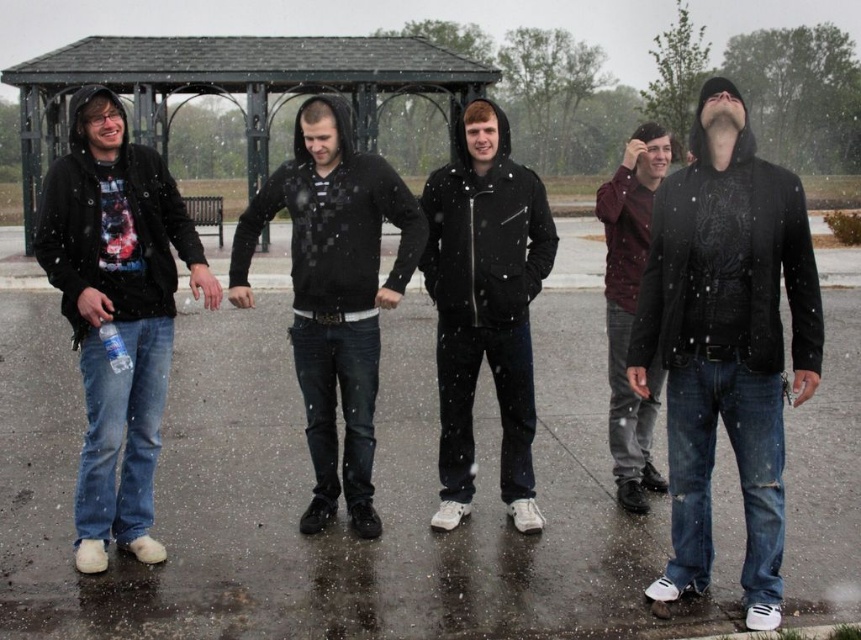
Question: Which object is the closest to the black matte hoodie at right?

Choices:
 (A) matte black jacket at center
 (B) maroon hoodie at center

Answer: (A)

Question: Based on their relative distances, which object is nearer to the maroon hoodie at center?

Choices:
 (A) matte black hoodie at center
 (B) black matte hoodie at right
 (C) matte black jacket at center

Answer: (C)

Question: Among these points, which one is farthest from the camera?

Choices:
 (A) (653, 483)
 (B) (155, 77)
 (C) (432, 232)
 (D) (767, 604)

Answer: (B)

Question: Can you confirm if matte black jacket at center is positioned to the right of black metal gazebo at upper left?

Choices:
 (A) no
 (B) yes

Answer: (B)

Question: Is matte black jacket at center behind black metal gazebo at upper left?

Choices:
 (A) yes
 (B) no

Answer: (B)

Question: Can you confirm if matte black hoodie at left is positioned above matte black hoodie at center?

Choices:
 (A) no
 (B) yes

Answer: (A)